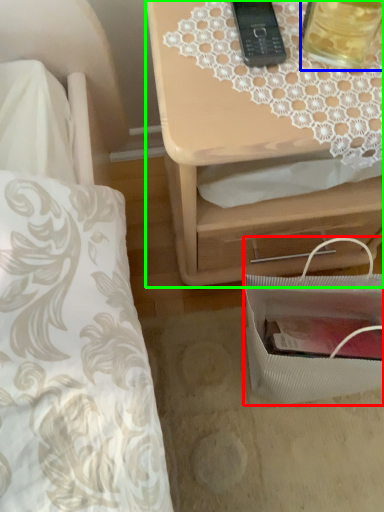
Question: Based on their relative distances, which object is farther from bag (highlighted by a red box)? Choose from beverage (highlighted by a blue box) and nightstand (highlighted by a green box).

Choices:
 (A) beverage
 (B) nightstand

Answer: (A)